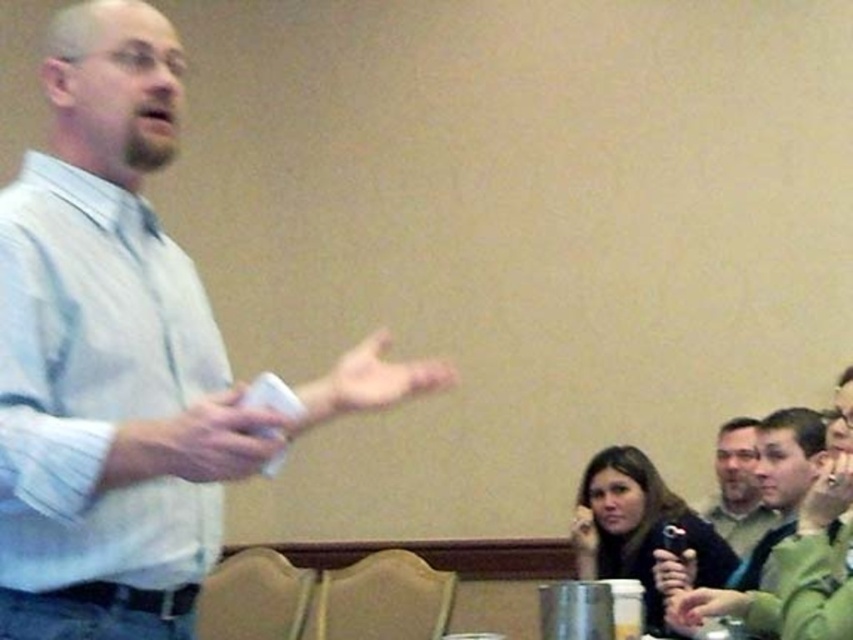
Question: Observing the image, what is the correct spatial positioning of white shirt at left in reference to green fabric shirt at center?

Choices:
 (A) above
 (B) below

Answer: (A)

Question: Does white shirt at left have a lesser width compared to green fabric shirt at center?

Choices:
 (A) yes
 (B) no

Answer: (B)

Question: Can you confirm if white shirt at left is smaller than green fabric shirt at center?

Choices:
 (A) yes
 (B) no

Answer: (B)

Question: Which of the following is the farthest from the observer?

Choices:
 (A) white shirt at left
 (B) green fabric shirt at center

Answer: (B)

Question: Which point is farther to the camera?

Choices:
 (A) (747, 449)
 (B) (47, 440)

Answer: (A)

Question: Which point is farther from the camera taking this photo?

Choices:
 (A) (749, 496)
 (B) (94, 541)

Answer: (A)